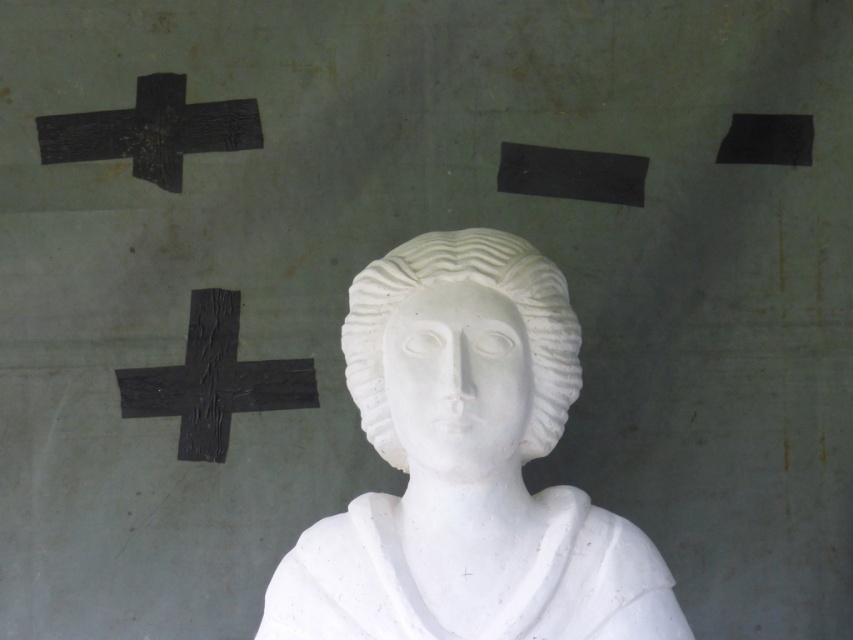
You are an art conservator tasked with moving the white marble bust at center and the black crumpled paper at left to a new display area. The new display area has a weight limit of 50 kilograms per object. Can you determine if both objects can be safely moved without exceeding the weight limit?

The white marble bust at center has a larger size compared to black crumpled paper at left. However, since the weight of each object is not provided in the description, it is impossible to determine if they exceed the 50 kg limit. Additional information about their weights is required to proceed safely.

You are an art conservator examining the white marble bust at center. You need to place a protective cover over it. The cover must be positioned precisely at point (467, 468). Can you confirm the exact location of the white marble bust at center?

The white marble bust at center is located at point (467, 468), so the protective cover should be placed exactly there.

You are an art conservator examining the sculpture in the image. You notice two objects labeled as the white marble bust at center and the white marble head at center. Which one is closer to you, the viewer?

The white marble bust at center is closer to you because it is in front of the white marble head at center.